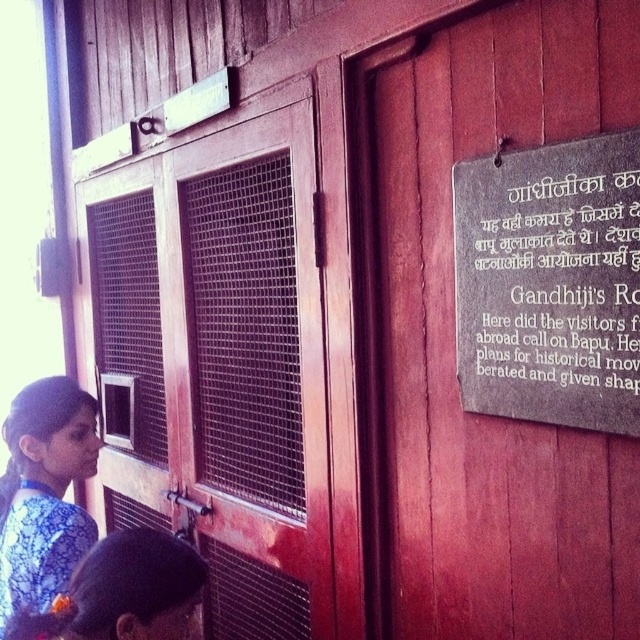
Question: In this image, where is wooden mesh door at center located relative to blue printed dress at lower left?

Choices:
 (A) above
 (B) below

Answer: (A)

Question: Which object is positioned farthest from the dark brown stone plaque at right?

Choices:
 (A) wooden mesh door at center
 (B) wooden door at center
 (C) blue printed dress at lower left

Answer: (C)

Question: Can you confirm if wooden mesh door at center is positioned to the right of blue printed dress at lower left?

Choices:
 (A) no
 (B) yes

Answer: (B)

Question: In this image, where is wooden mesh door at center located relative to wooden door at center?

Choices:
 (A) above
 (B) below

Answer: (B)

Question: Which point is farther from the camera taking this photo?

Choices:
 (A) (502, 61)
 (B) (465, 250)
 (C) (38, 435)
 (D) (256, 452)

Answer: (D)

Question: Which point is farther from the camera taking this photo?

Choices:
 (A) (8, 548)
 (B) (257, 188)
 (C) (436, 129)
 (D) (602, 374)

Answer: (B)